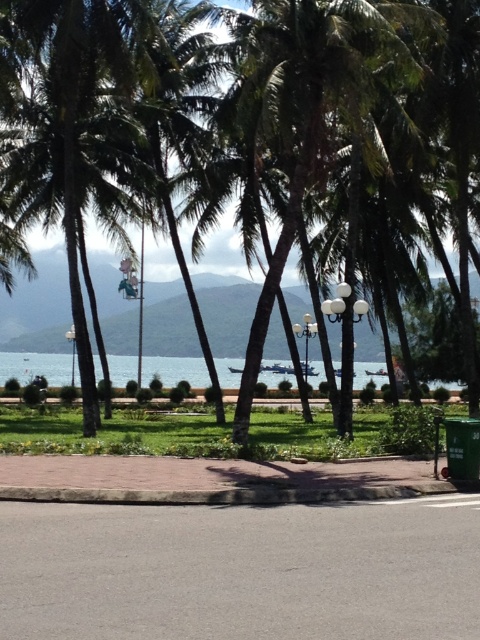
Is point (245, 420) more distant than point (457, 388)?

No.

Is point (383, 182) closer to camera compared to point (276, 376)?

Yes, point (383, 182) is in front of point (276, 376).

Locate an element on the screen. This screenshot has width=480, height=640. green leafy coconut tree at center is located at coordinates (363, 132).